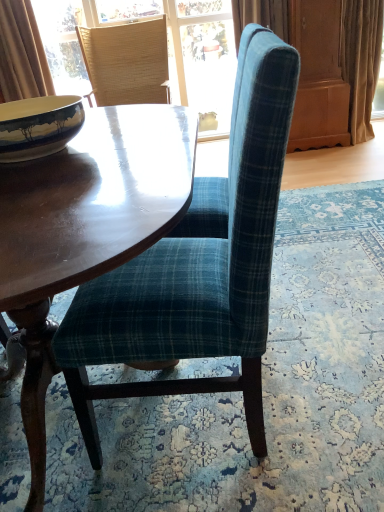
Measure the distance between beige fabric curtain at right, positioned as the second curtain in left-to-right order, and camera.

beige fabric curtain at right, positioned as the second curtain in left-to-right order, and camera are 2.88 meters apart.

What do you see at coordinates (22, 53) in the screenshot? The height and width of the screenshot is (512, 384). I see `brown velvet curtain at upper left, the 1th curtain positioned from the left` at bounding box center [22, 53].

Image resolution: width=384 pixels, height=512 pixels. What are the coordinates of `shiny brown wood coffee table at center` in the screenshot? It's located at (85, 228).

Looking at this image, measure the distance between shiny brown wood coffee table at center and camera.

shiny brown wood coffee table at center is 23.27 inches away from camera.

In the scene shown: Measure the distance between point (262,300) and camera.

Point (262,300) and camera are 86.20 centimeters apart from each other.

Image resolution: width=384 pixels, height=512 pixels. I want to click on teal plaid fabric chair at center, arranged as the 2th chair when viewed from the back, so click(x=197, y=268).

What is the approximate width of woven straw chair at upper left, positioned as the 1th chair in top-to-bottom order?

It is 23.06 inches.

Image resolution: width=384 pixels, height=512 pixels. What do you see at coordinates (127, 63) in the screenshot?
I see `woven straw chair at upper left, positioned as the second chair in bottom-to-top order` at bounding box center [127, 63].

Identify the location of matte ceramic bowl at left. The height and width of the screenshot is (512, 384). (39, 127).

Is beige fabric curtain at right, placed as the 1th curtain when sorted from right to left, turned away from brown velvet curtain at upper left, the 1th curtain positioned from the left?

That's not correct — beige fabric curtain at right, placed as the 1th curtain when sorted from right to left, is not looking away from brown velvet curtain at upper left, the 1th curtain positioned from the left.

Is beige fabric curtain at right, placed as the 1th curtain when sorted from right to left, next to brown velvet curtain at upper left, the second curtain viewed from the right, and touching it?

No, beige fabric curtain at right, placed as the 1th curtain when sorted from right to left, is not touching brown velvet curtain at upper left, the second curtain viewed from the right.

What's the angular difference between beige fabric curtain at right, positioned as the second curtain in left-to-right order, and brown velvet curtain at upper left, the 1th curtain positioned from the left,'s facing directions?

There is a 3.23-degree angle between the facing directions of beige fabric curtain at right, positioned as the second curtain in left-to-right order, and brown velvet curtain at upper left, the 1th curtain positioned from the left.

Is beige fabric curtain at right, placed as the 1th curtain when sorted from right to left, at the left side of brown velvet curtain at upper left, the 1th curtain positioned from the left?

No, beige fabric curtain at right, placed as the 1th curtain when sorted from right to left, is not to the left of brown velvet curtain at upper left, the 1th curtain positioned from the left.

From the image's perspective, is shiny brown wood coffee table at center located above beige fabric curtain at right, positioned as the second curtain in left-to-right order?

No, from the image's perspective, shiny brown wood coffee table at center is not on top of beige fabric curtain at right, positioned as the second curtain in left-to-right order.

From a real-world perspective, is shiny brown wood coffee table at center over beige fabric curtain at right, placed as the 1th curtain when sorted from right to left?

No, from a real-world perspective, shiny brown wood coffee table at center is not on top of beige fabric curtain at right, placed as the 1th curtain when sorted from right to left.

Which object is thinner, shiny brown wood coffee table at center or beige fabric curtain at right, positioned as the second curtain in left-to-right order?

beige fabric curtain at right, positioned as the second curtain in left-to-right order, is thinner.

Are beige fabric curtain at right, placed as the 1th curtain when sorted from right to left, and shiny brown wood coffee table at center beside each other?

beige fabric curtain at right, placed as the 1th curtain when sorted from right to left, is not next to shiny brown wood coffee table at center, and they're not touching.

Does beige fabric curtain at right, positioned as the second curtain in left-to-right order, appear on the left side of shiny brown wood coffee table at center?

No.

From a real-world perspective, relative to shiny brown wood coffee table at center, is beige fabric curtain at right, placed as the 1th curtain when sorted from right to left, vertically above or below?

In terms of real-world spatial position, beige fabric curtain at right, placed as the 1th curtain when sorted from right to left, is above shiny brown wood coffee table at center.

Who is smaller, beige fabric curtain at right, positioned as the second curtain in left-to-right order, or shiny brown wood coffee table at center?

beige fabric curtain at right, positioned as the second curtain in left-to-right order, is smaller.

Measure the distance between brown velvet curtain at upper left, the second curtain viewed from the right, and matte ceramic bowl at left.

brown velvet curtain at upper left, the second curtain viewed from the right, and matte ceramic bowl at left are 2.39 meters apart.

Does brown velvet curtain at upper left, the second curtain viewed from the right, have a greater height compared to matte ceramic bowl at left?

Correct, brown velvet curtain at upper left, the second curtain viewed from the right, is much taller as matte ceramic bowl at left.

Considering the relative positions of brown velvet curtain at upper left, the 1th curtain positioned from the left, and matte ceramic bowl at left in the image provided, is brown velvet curtain at upper left, the 1th curtain positioned from the left, to the right of matte ceramic bowl at left from the viewer's perspective?

Incorrect, brown velvet curtain at upper left, the 1th curtain positioned from the left, is not on the right side of matte ceramic bowl at left.

How many degrees apart are the facing directions of brown velvet curtain at upper left, the 1th curtain positioned from the left, and matte ceramic bowl at left?

86.7 degrees.

Considering the relative sizes of beige fabric curtain at right, placed as the 1th curtain when sorted from right to left, and matte ceramic bowl at left in the image provided, is beige fabric curtain at right, placed as the 1th curtain when sorted from right to left, bigger than matte ceramic bowl at left?

Yes.

Find the location of a particular element. Image resolution: width=384 pixels, height=512 pixels. bowl below the beige fabric curtain at right, positioned as the second curtain in left-to-right order (from the image's perspective) is located at coordinates (39, 127).

From a real-world perspective, which object stands above the other?

In real-world perspective, matte ceramic bowl at left is above.

Considering the relative sizes of matte ceramic bowl at left and beige fabric curtain at right, positioned as the second curtain in left-to-right order, in the image provided, is matte ceramic bowl at left bigger than beige fabric curtain at right, positioned as the second curtain in left-to-right order,?

No.

Between point (43, 104) and point (378, 29), which one is positioned in front?

Point (43, 104)

Visually, is matte ceramic bowl at left positioned to the left or to the right of beige fabric curtain at right, positioned as the second curtain in left-to-right order?

matte ceramic bowl at left is to the left of beige fabric curtain at right, positioned as the second curtain in left-to-right order.

Considering the sizes of matte ceramic bowl at left and beige fabric curtain at right, placed as the 1th curtain when sorted from right to left, in the image, is matte ceramic bowl at left wider or thinner than beige fabric curtain at right, placed as the 1th curtain when sorted from right to left,?

Considering their sizes, matte ceramic bowl at left looks slimmer than beige fabric curtain at right, placed as the 1th curtain when sorted from right to left.

Can you confirm if matte ceramic bowl at left is taller than brown velvet curtain at upper left, the second curtain viewed from the right?

Incorrect, the height of matte ceramic bowl at left is not larger of that of brown velvet curtain at upper left, the second curtain viewed from the right.

From the image's perspective, which one is positioned higher, matte ceramic bowl at left or brown velvet curtain at upper left, the second curtain viewed from the right?

brown velvet curtain at upper left, the second curtain viewed from the right, appears higher in the image.

Considering the relative sizes of matte ceramic bowl at left and brown velvet curtain at upper left, the second curtain viewed from the right, in the image provided, is matte ceramic bowl at left thinner than brown velvet curtain at upper left, the second curtain viewed from the right,?

In fact, matte ceramic bowl at left might be wider than brown velvet curtain at upper left, the second curtain viewed from the right.

Which is more to the left, matte ceramic bowl at left or brown velvet curtain at upper left, the 1th curtain positioned from the left?

Positioned to the left is brown velvet curtain at upper left, the 1th curtain positioned from the left.

This screenshot has height=512, width=384. What are the coordinates of `curtain below the brown velvet curtain at upper left, the second curtain viewed from the right (from a real-world perspective)` in the screenshot? It's located at pos(361,61).

Identify the location of curtain that appears on the right of shiny brown wood coffee table at center. (361, 61).

Considering their positions, is teal plaid fabric chair at center, arranged as the 2th chair when viewed from the back, positioned closer to matte ceramic bowl at left than brown velvet curtain at upper left, the 1th curtain positioned from the left?

The object closer to matte ceramic bowl at left is teal plaid fabric chair at center, arranged as the 2th chair when viewed from the back.

Consider the image. Looking at the image, which one is located closer to shiny brown wood coffee table at center, brown velvet curtain at upper left, the 1th curtain positioned from the left, or teal plaid fabric chair at center, the first chair from the front?

teal plaid fabric chair at center, the first chair from the front, is closer to shiny brown wood coffee table at center.

Based on their spatial positions, is teal plaid fabric chair at center, the 2th chair positioned from the top, or beige fabric curtain at right, positioned as the second curtain in left-to-right order, further from brown velvet curtain at upper left, the second curtain viewed from the right?

The object further to brown velvet curtain at upper left, the second curtain viewed from the right, is teal plaid fabric chair at center, the 2th chair positioned from the top.

Based on their spatial positions, is teal plaid fabric chair at center, the first chair from the front, or shiny brown wood coffee table at center closer to matte ceramic bowl at left?

The object closer to matte ceramic bowl at left is shiny brown wood coffee table at center.

Based on the photo, which object lies nearer to the anchor point brown velvet curtain at upper left, the 1th curtain positioned from the left, beige fabric curtain at right, positioned as the second curtain in left-to-right order, or shiny brown wood coffee table at center?

shiny brown wood coffee table at center lies closer to brown velvet curtain at upper left, the 1th curtain positioned from the left, than the other object.

Looking at the image, which one is located closer to matte ceramic bowl at left, brown velvet curtain at upper left, the second curtain viewed from the right, or teal plaid fabric chair at center, the 2th chair positioned from the top?

teal plaid fabric chair at center, the 2th chair positioned from the top.

Considering their positions, is shiny brown wood coffee table at center positioned further to woven straw chair at upper left, positioned as the first chair in back-to-front order, than brown velvet curtain at upper left, the second curtain viewed from the right?

shiny brown wood coffee table at center is positioned further to the anchor woven straw chair at upper left, positioned as the first chair in back-to-front order.

Estimate the real-world distances between objects in this image. Which object is closer to shiny brown wood coffee table at center, beige fabric curtain at right, placed as the 1th curtain when sorted from right to left, or brown velvet curtain at upper left, the 1th curtain positioned from the left?

Based on the image, brown velvet curtain at upper left, the 1th curtain positioned from the left, appears to be nearer to shiny brown wood coffee table at center.

You are a GUI agent. You are given a task and a screenshot of the screen. Output one action in this format:
    pyautogui.click(x=<x>, y=<y>)
    Task: Click on the bowl between teal plaid fabric chair at center, the first chair from the front, and beige fabric curtain at right, placed as the 1th curtain when sorted from right to left, in the front-back direction
    
    Given the screenshot: What is the action you would take?
    pyautogui.click(x=39, y=127)

Find the location of a particular element. The width and height of the screenshot is (384, 512). bowl between shiny brown wood coffee table at center and beige fabric curtain at right, placed as the 1th curtain when sorted from right to left, in the front-back direction is located at coordinates (39, 127).

Find the location of a particular element. chair between teal plaid fabric chair at center, the 2th chair positioned from the top, and beige fabric curtain at right, positioned as the second curtain in left-to-right order, in the front-back direction is located at coordinates (127, 63).

You are a GUI agent. You are given a task and a screenshot of the screen. Output one action in this format:
    pyautogui.click(x=<x>, y=<y>)
    Task: Click on the chair between teal plaid fabric chair at center, the 1th chair in the bottom-to-top sequence, and brown velvet curtain at upper left, the second curtain viewed from the right, along the z-axis
    This screenshot has width=384, height=512.
    Given the screenshot: What is the action you would take?
    pyautogui.click(x=127, y=63)